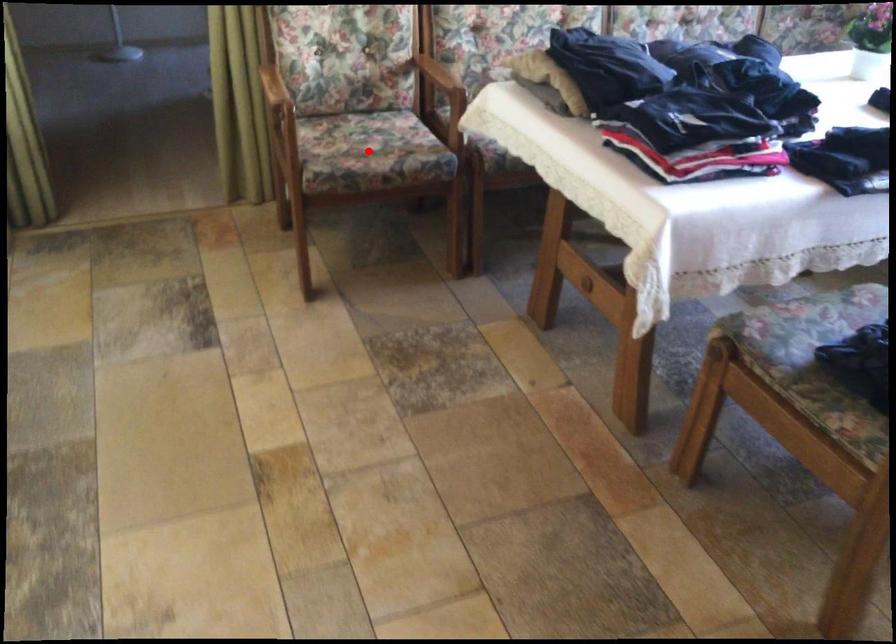
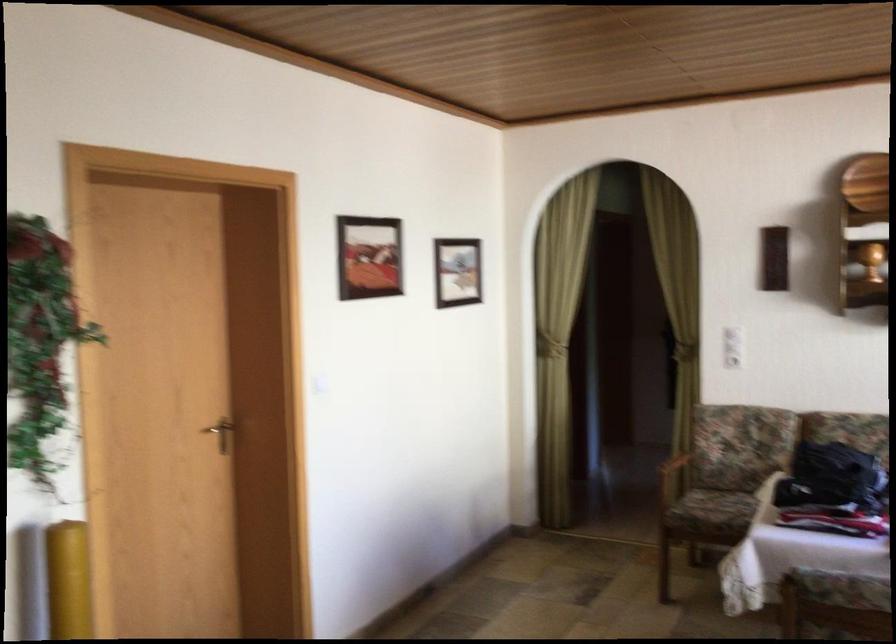
Where in the second image is the point corresponding to the highlighted location from the first image?

(725, 507)